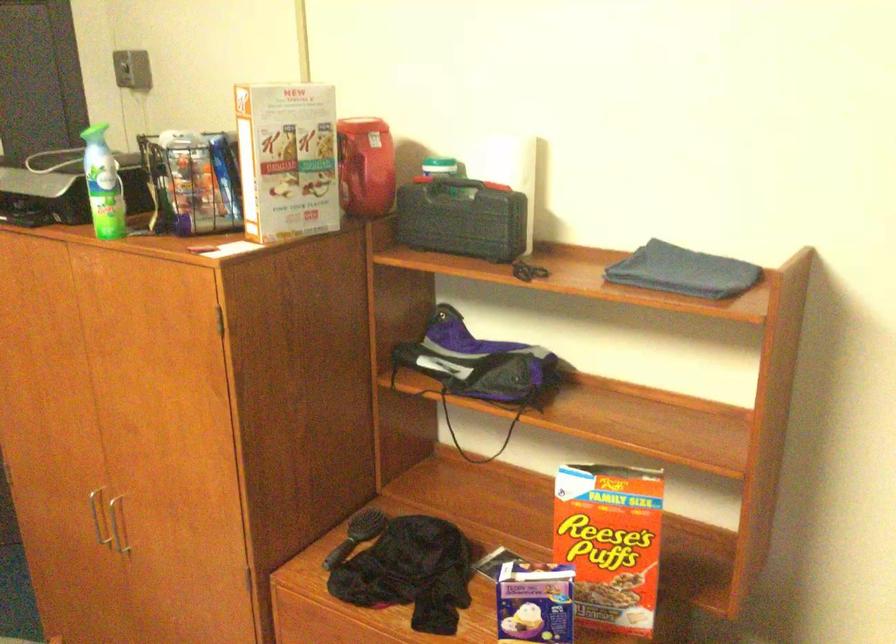
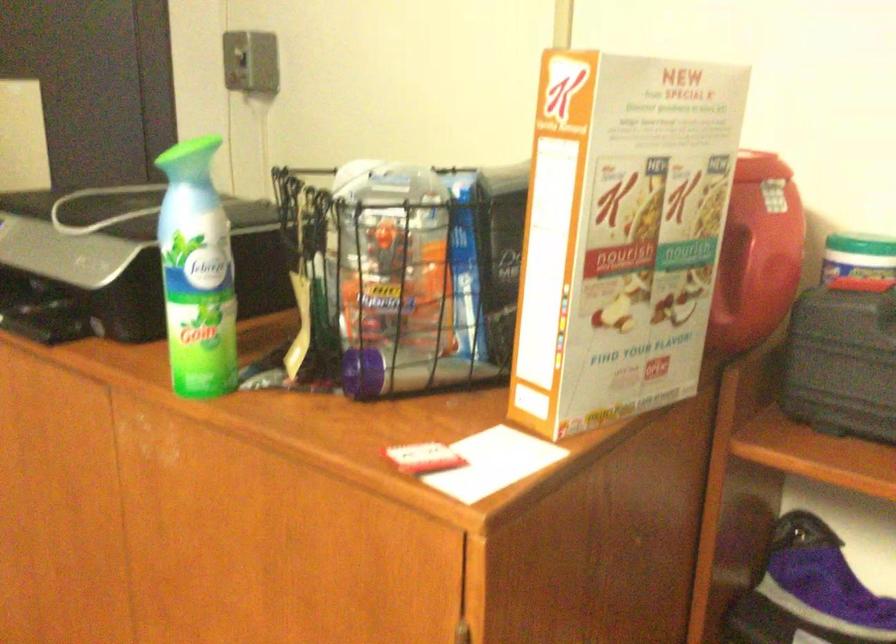
What movement of the cameraman would produce the second image?

The cameraman walked toward left, forward.